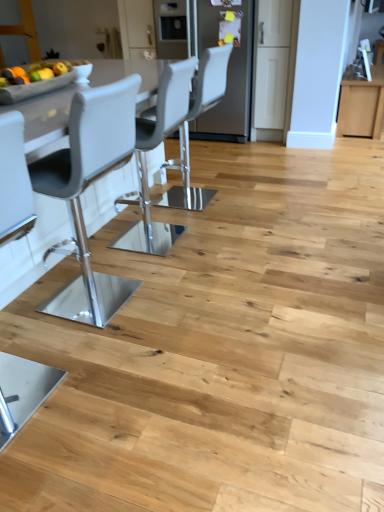
Question: From the image's perspective, is matte gray chair at center, acting as the first chair starting from the right, under satin stainless steel refrigerator at center?

Choices:
 (A) no
 (B) yes

Answer: (B)

Question: Is the surface of matte gray chair at center, acting as the first chair starting from the right, in direct contact with satin stainless steel refrigerator at center?

Choices:
 (A) no
 (B) yes

Answer: (A)

Question: Is matte gray chair at center, which is the 1th chair in back-to-front order, not within satin stainless steel refrigerator at center?

Choices:
 (A) yes
 (B) no

Answer: (A)

Question: Considering the relative positions of matte gray chair at center, acting as the second chair starting from the left, and satin stainless steel refrigerator at center in the image provided, is matte gray chair at center, acting as the second chair starting from the left, in front of satin stainless steel refrigerator at center?

Choices:
 (A) yes
 (B) no

Answer: (A)

Question: From a real-world perspective, is matte gray chair at center, acting as the second chair starting from the left, physically below satin stainless steel refrigerator at center?

Choices:
 (A) yes
 (B) no

Answer: (A)

Question: Considering the relative sizes of matte gray chair at center, acting as the first chair starting from the right, and satin stainless steel refrigerator at center in the image provided, is matte gray chair at center, acting as the first chair starting from the right, wider than satin stainless steel refrigerator at center?

Choices:
 (A) yes
 (B) no

Answer: (B)

Question: Does satin stainless steel refrigerator at center have a smaller size compared to matte gray chair at left, the 2th chair when ordered from right to left?

Choices:
 (A) no
 (B) yes

Answer: (A)

Question: From a real-world perspective, does satin stainless steel refrigerator at center stand above matte gray chair at left, acting as the 2th chair starting from the top?

Choices:
 (A) no
 (B) yes

Answer: (B)

Question: Is satin stainless steel refrigerator at center positioned with its back to matte gray chair at left, acting as the 2th chair starting from the top?

Choices:
 (A) yes
 (B) no

Answer: (B)

Question: Is satin stainless steel refrigerator at center at the left side of matte gray chair at left, which is counted as the 1th chair, starting from the bottom?

Choices:
 (A) yes
 (B) no

Answer: (B)

Question: From the image's perspective, is satin stainless steel refrigerator at center on top of matte gray chair at left, which is the first chair from front to back?

Choices:
 (A) yes
 (B) no

Answer: (A)

Question: Does satin stainless steel refrigerator at center appear on the right side of matte gray chair at left, which is the first chair from front to back?

Choices:
 (A) no
 (B) yes

Answer: (B)

Question: From the image's perspective, is matte gray chair at center, which is the 1th chair in back-to-front order, on top of matte gray chair at left, the first chair viewed from the left?

Choices:
 (A) no
 (B) yes

Answer: (B)